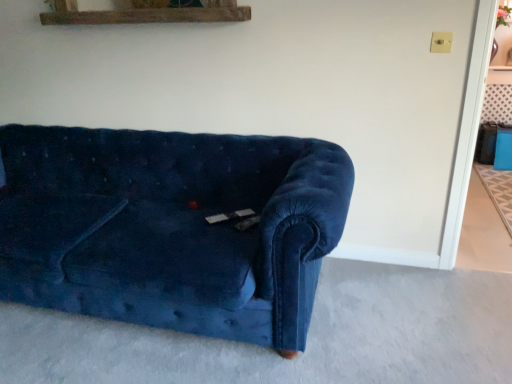
Question: Is velvet couch at lower left, the first concrete from the bottom, positioned with its back to velvet blue couch at center?

Choices:
 (A) no
 (B) yes

Answer: (A)

Question: Considering the relative sizes of velvet couch at lower left, the first concrete from the bottom, and velvet blue couch at center in the image provided, is velvet couch at lower left, the first concrete from the bottom, smaller than velvet blue couch at center?

Choices:
 (A) no
 (B) yes

Answer: (B)

Question: Is velvet couch at lower left, which is counted as the first concrete, starting from the front, completely or partially outside of velvet blue couch at center?

Choices:
 (A) yes
 (B) no

Answer: (A)

Question: Does velvet couch at lower left, the 2th concrete positioned from the right, have a greater width compared to velvet blue couch at center?

Choices:
 (A) yes
 (B) no

Answer: (A)

Question: Is velvet blue couch at center completely or partially inside velvet couch at lower left, the 2th concrete when ordered from top to bottom?

Choices:
 (A) yes
 (B) no

Answer: (B)

Question: Does velvet couch at lower left, the 2th concrete positioned from the back, have a larger size compared to velvet blue couch at center?

Choices:
 (A) no
 (B) yes

Answer: (A)

Question: From the image's perspective, is beige carpet at lower right, the first concrete in the back-to-front sequence, on top of velvet blue couch at center?

Choices:
 (A) no
 (B) yes

Answer: (B)

Question: Is beige carpet at lower right, which appears as the second concrete when viewed from the left, to the right of velvet blue couch at center from the viewer's perspective?

Choices:
 (A) no
 (B) yes

Answer: (B)

Question: Considering the relative positions of beige carpet at lower right, which appears as the first concrete when viewed from the top, and velvet blue couch at center in the image provided, is beige carpet at lower right, which appears as the first concrete when viewed from the top, to the left of velvet blue couch at center from the viewer's perspective?

Choices:
 (A) yes
 (B) no

Answer: (B)

Question: Are beige carpet at lower right, placed as the second concrete when sorted from front to back, and velvet blue couch at center making contact?

Choices:
 (A) yes
 (B) no

Answer: (B)

Question: Is beige carpet at lower right, which appears as the second concrete when viewed from the left, positioned behind velvet blue couch at center?

Choices:
 (A) yes
 (B) no

Answer: (A)

Question: Can you confirm if beige carpet at lower right, placed as the second concrete when sorted from front to back, is shorter than velvet blue couch at center?

Choices:
 (A) yes
 (B) no

Answer: (A)

Question: Considering the relative sizes of velvet blue couch at center and velvet couch at lower left, the 2th concrete when ordered from top to bottom, in the image provided, is velvet blue couch at center smaller than velvet couch at lower left, the 2th concrete when ordered from top to bottom,?

Choices:
 (A) yes
 (B) no

Answer: (B)